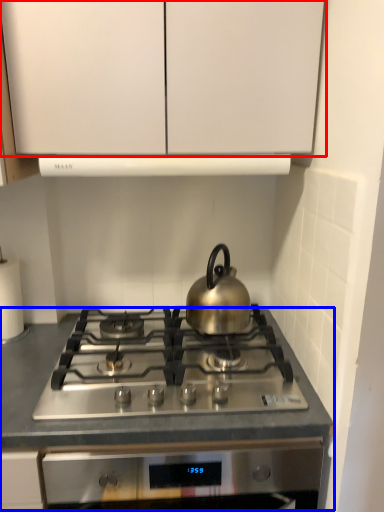
Question: Which object appears closest to the camera in this image, cabinetry (highlighted by a red box) or counter (highlighted by a blue box)?

Choices:
 (A) cabinetry
 (B) counter

Answer: (A)